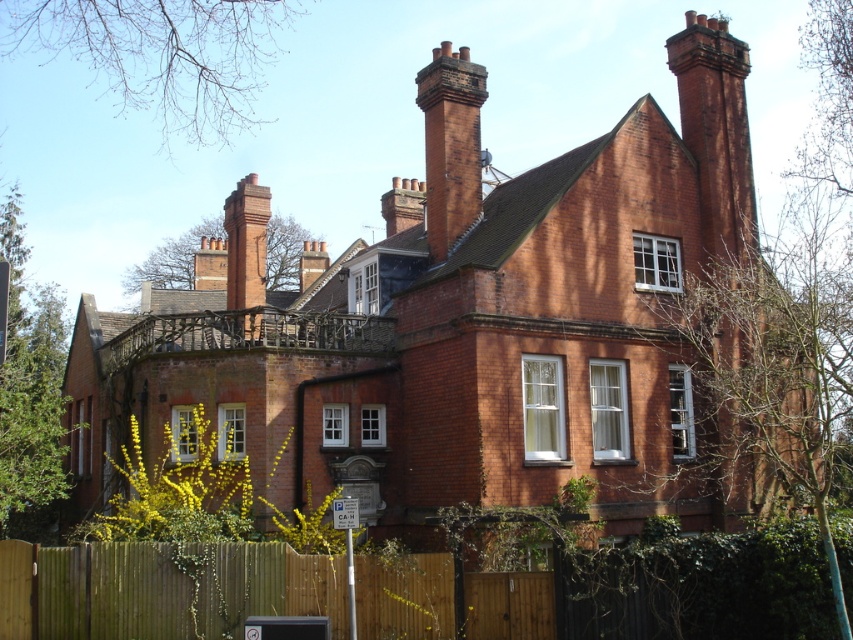
You are standing in front of the house and want to walk towards the brown wooden fence at lower center. Which direction should you head relative to the red brick chimney at upper left?

The brown wooden fence at lower center is located below the red brick chimney at upper left, so you should walk towards the direction below the red brick chimney at upper left to reach the brown wooden fence at lower center.

You are an architect evaluating the symmetry of the house. You notice two red brick chimneys on the roof. Which one is narrower between the red brick chimney at upper center and the red brick chimney at upper left?

The red brick chimney at upper center is narrower than the red brick chimney at upper left.

You are standing in front of the house and want to take a photo of the red brick chimney at upper center without the brown wooden fence at lower center blocking the view. Where should you position yourself to ensure the chimney is fully visible?

To ensure the red brick chimney at upper center is fully visible without the brown wooden fence at lower center blocking the view, position yourself so that you are looking upward and slightly away from the lower center area where the fence is located. This angle will allow the chimney to be framed above the fence.